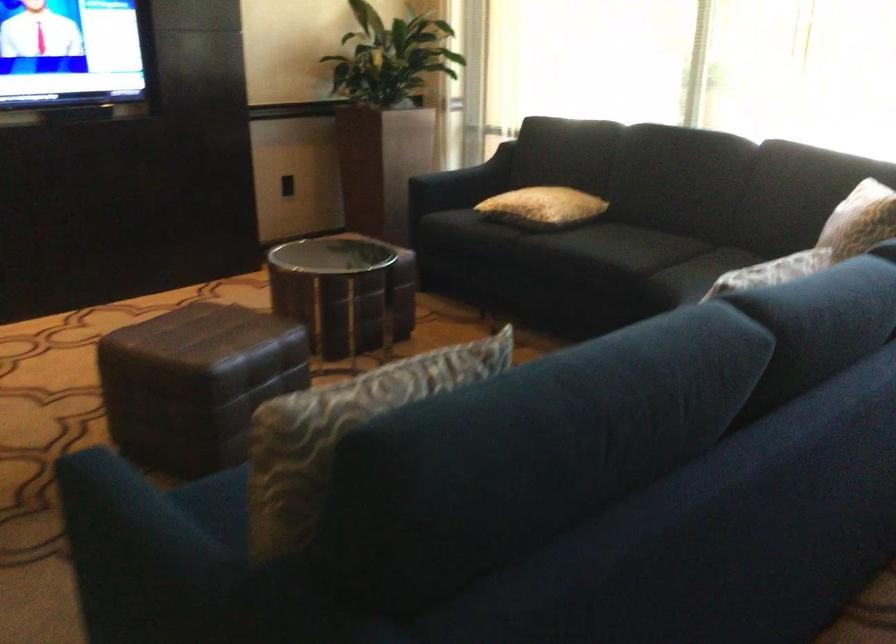
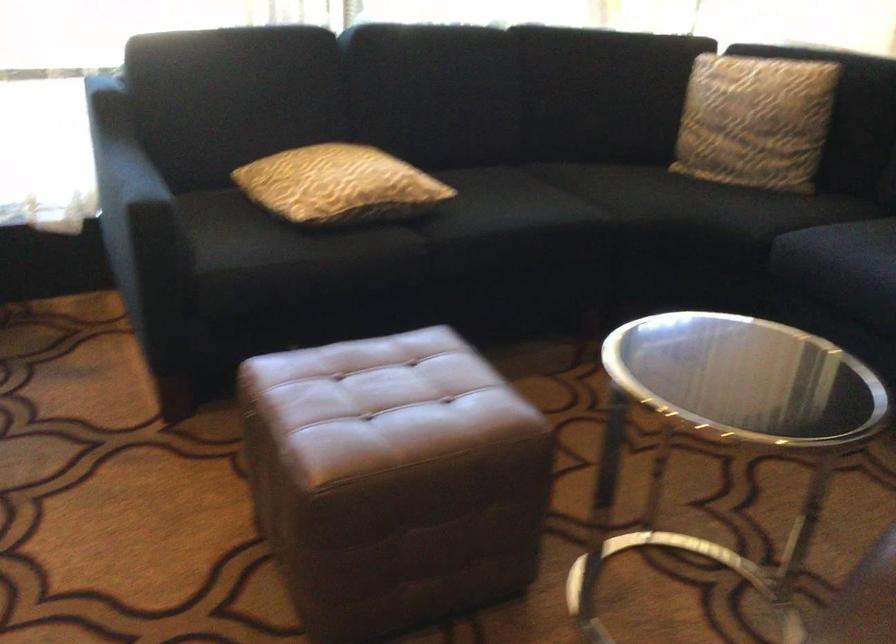
Locate, in the second image, the point that corresponds to pixel 545 238 in the first image.

(426, 227)